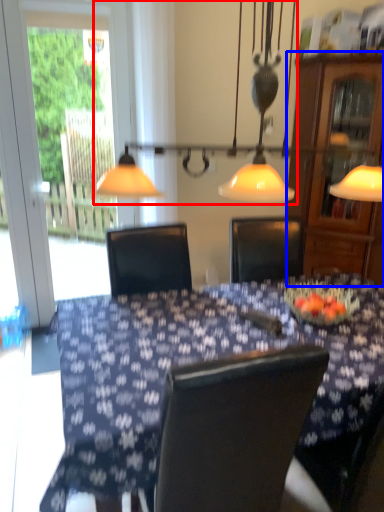
Question: Among these objects, which one is nearest to the camera, lamp (highlighted by a red box) or cabinetry (highlighted by a blue box)?

Choices:
 (A) lamp
 (B) cabinetry

Answer: (A)